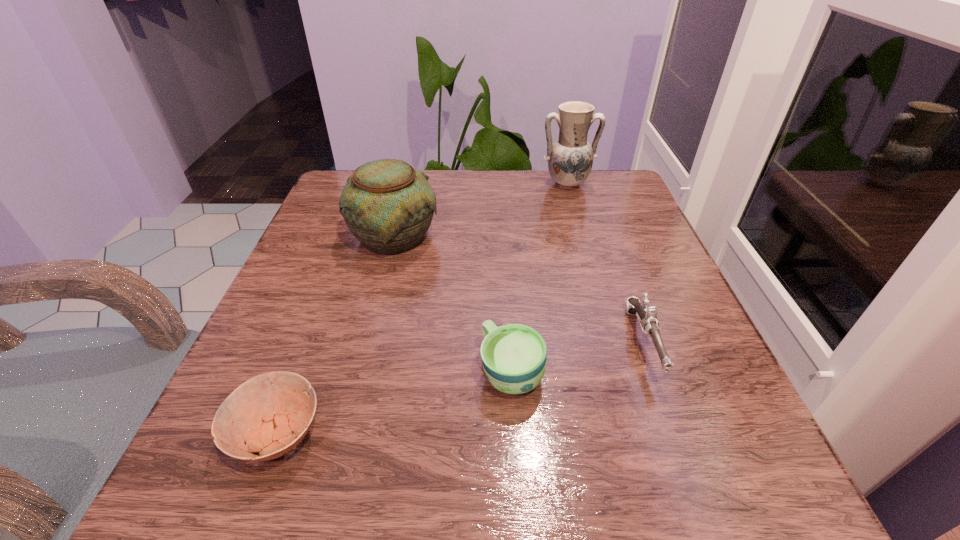
Locate an element on the screen. the tallest object is located at coordinates (570, 159).

You are a GUI agent. You are given a task and a screenshot of the screen. Output one action in this format:
    pyautogui.click(x=<x>, y=<y>)
    Task: Click on the farther pottery
    The width and height of the screenshot is (960, 540).
    Given the screenshot: What is the action you would take?
    pyautogui.click(x=570, y=159)

Identify the location of the second farthest object. (387, 205).

This screenshot has width=960, height=540. Find the location of `the left pottery`. the left pottery is located at coordinates (387, 205).

Identify the location of gun. [x=648, y=316].

This screenshot has width=960, height=540. In order to click on cup in this screenshot , I will do `click(514, 356)`.

I want to click on bowl, so click(264, 412).

You are a GUI agent. You are given a task and a screenshot of the screen. Output one action in this format:
    pyautogui.click(x=<x>, y=<y>)
    Task: Click on the blank space located on either side of the tallest object
    
    Given the screenshot: What is the action you would take?
    pyautogui.click(x=593, y=274)

I want to click on vacant space located 0.160m on the front of the second farthest object, so click(372, 323).

Identify the location of vacant space located aimed along the barrel of the gun. (678, 437).